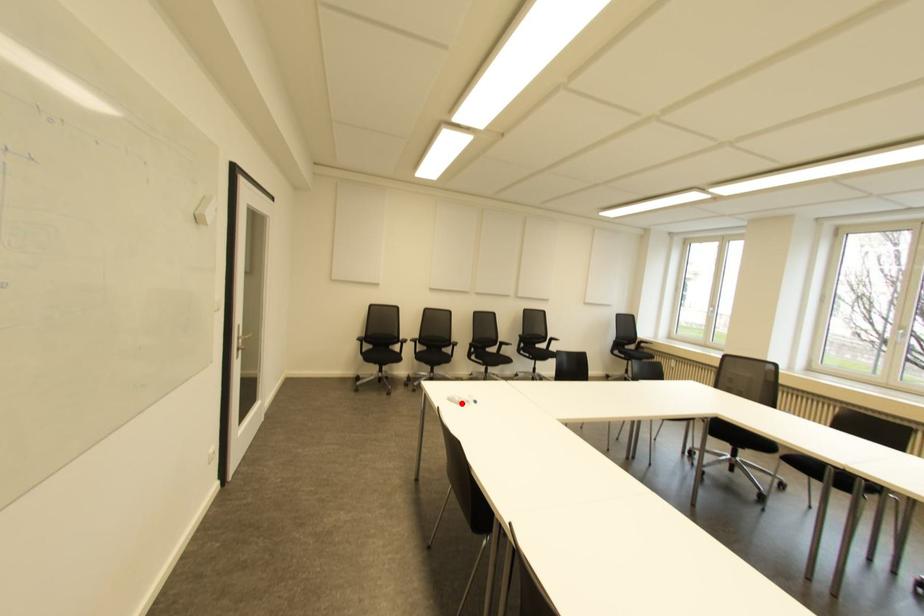
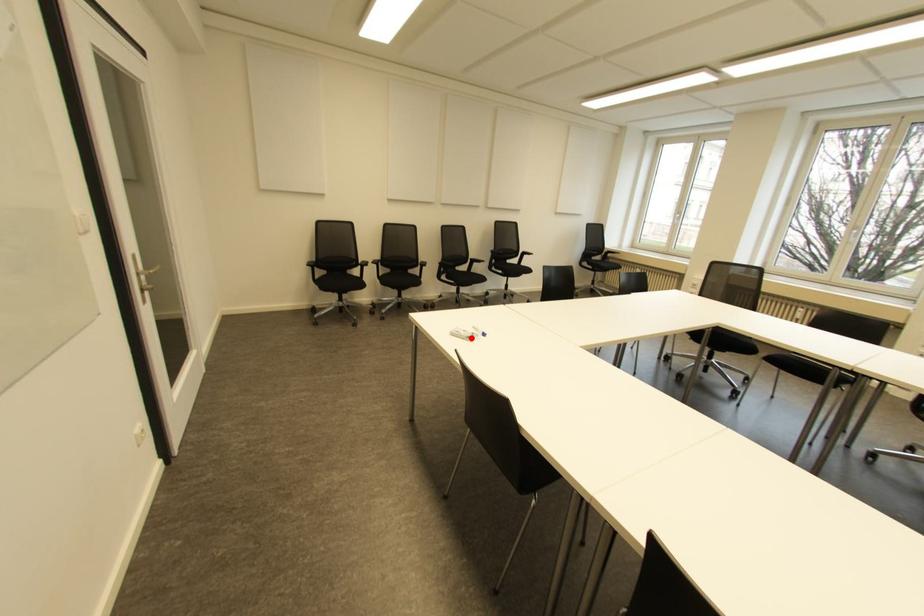
I am providing you with two images of the same scene from different viewpoints. A red point is marked on the first image and another point is marked on the second image. Are the points marked in image1 and image2 representing the same 3D position?

Yes